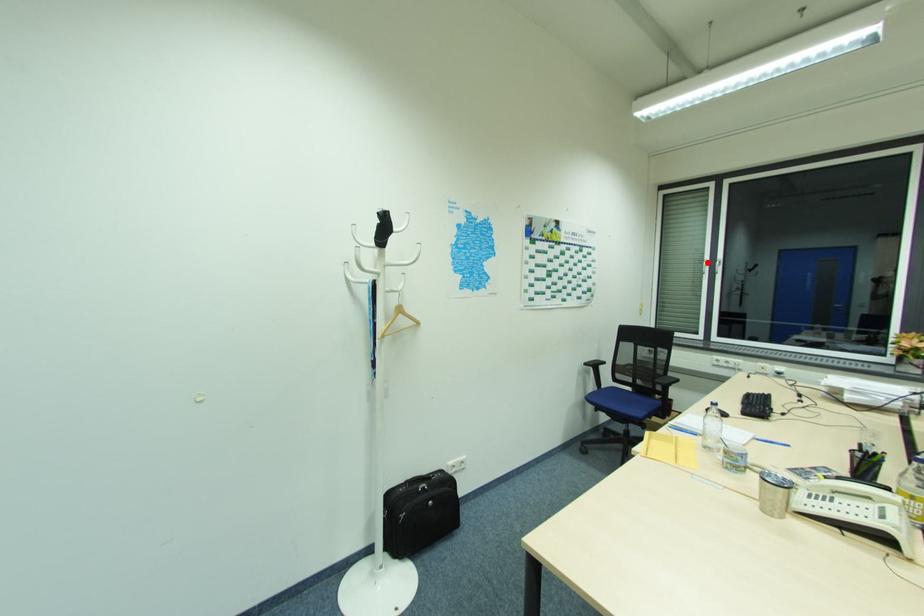
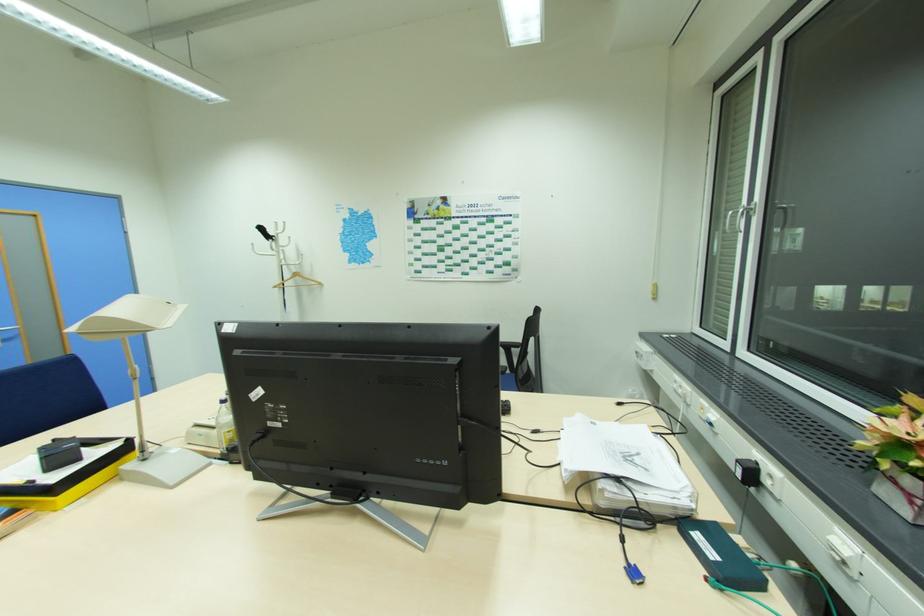
Where in the second image is the point corresponding to the highlighted location from the first image?

(733, 213)